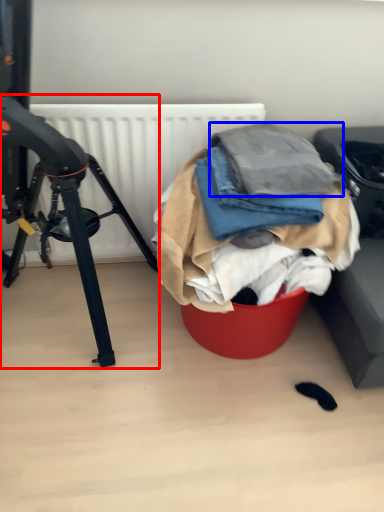
Question: Which object is further to the camera taking this photo, tripod (highlighted by a red box) or clothing (highlighted by a blue box)?

Choices:
 (A) tripod
 (B) clothing

Answer: (B)